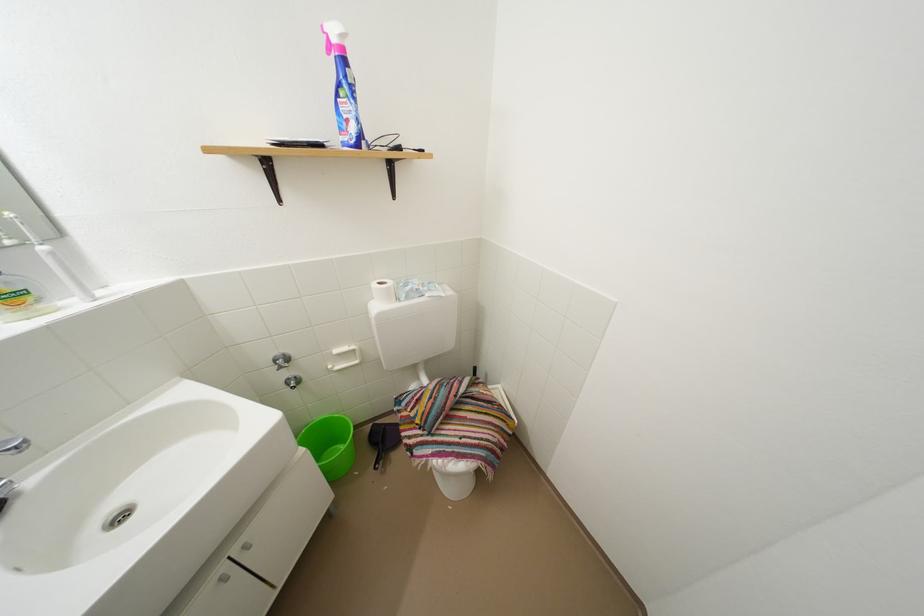
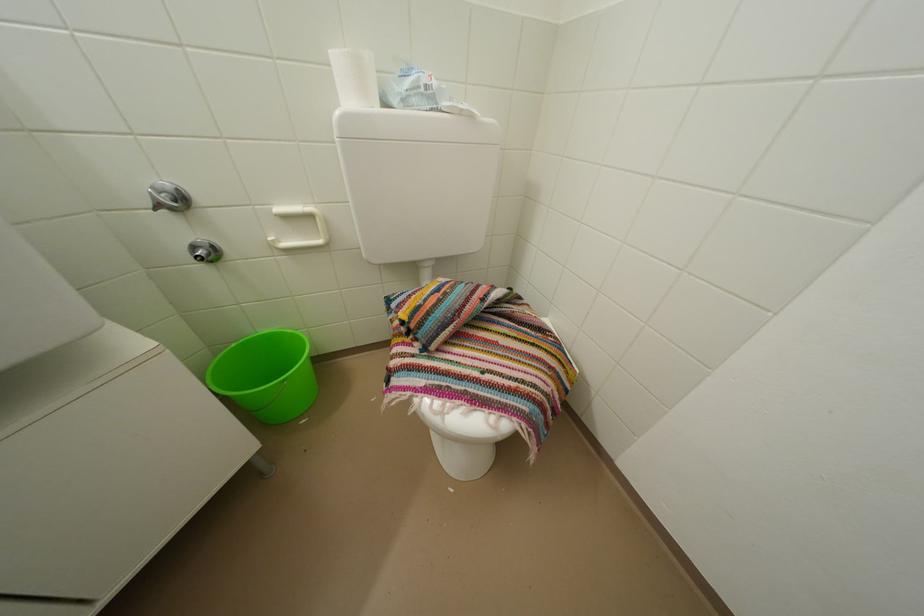
Question: Which direction would the cameraman need to move to produce the second image? Reply with the corresponding letter.

Choices:
 (A) Left
 (B) Right
 (C) Forward
 (D) Backward

Answer: (C)